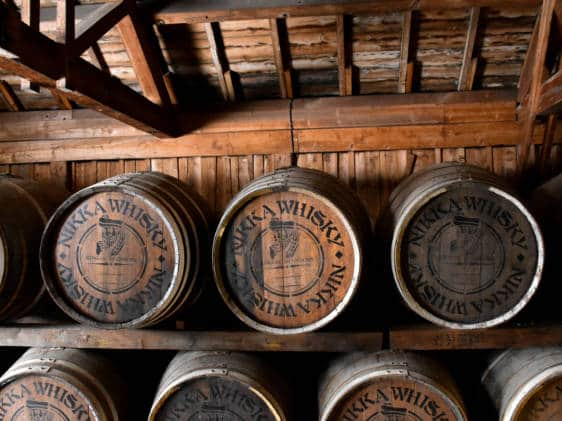
This screenshot has width=562, height=421. Identify the location of shelves. (117, 342), (406, 344).